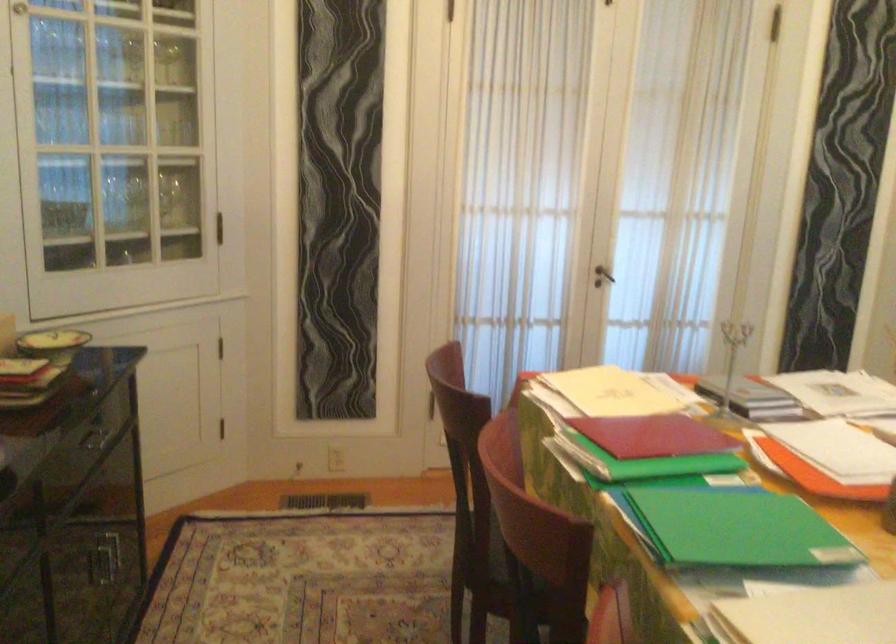
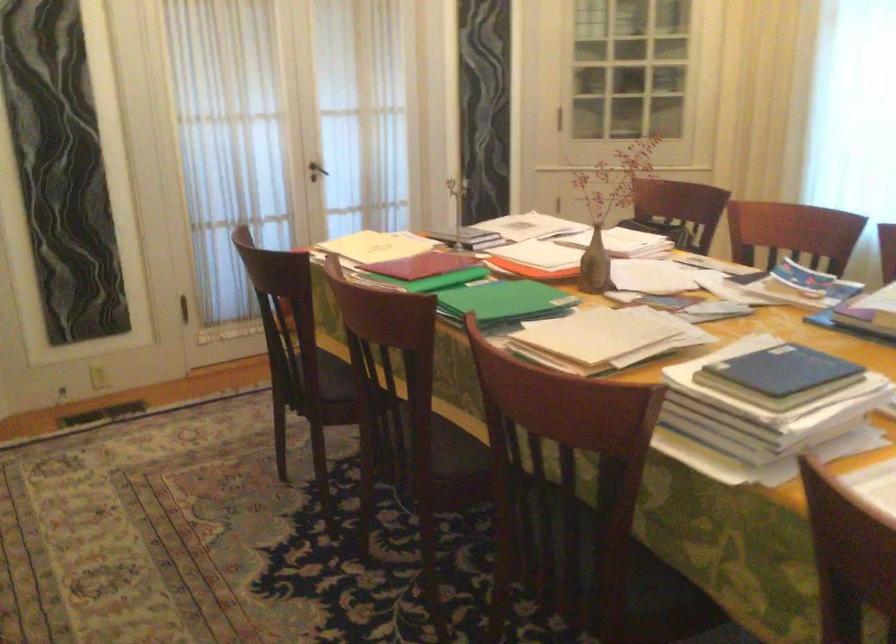
What movement of the cameraman would produce the second image?

The movement direction of the cameraman is left, backward.